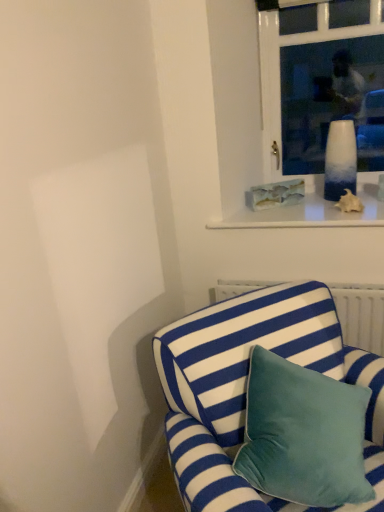
What is the approximate width of blue and white striped fabric couch at lower right?

It is 31.85 inches.

The image size is (384, 512). Find the location of `blue and white striped fabric couch at lower right`. blue and white striped fabric couch at lower right is located at coordinates (246, 386).

Is blue and white striped fabric couch at lower right directly adjacent to white glass vase at upper center?

blue and white striped fabric couch at lower right and white glass vase at upper center are not in contact.

Considering the sizes of objects blue and white striped fabric couch at lower right and white glass vase at upper center in the image provided, who is wider, blue and white striped fabric couch at lower right or white glass vase at upper center?

blue and white striped fabric couch at lower right.

Is blue and white striped fabric couch at lower right smaller than white glass vase at upper center?

No, blue and white striped fabric couch at lower right is not smaller than white glass vase at upper center.

From the picture: From a real-world perspective, is blue and white striped fabric couch at lower right over white glass vase at upper center?

No, from a real-world perspective, blue and white striped fabric couch at lower right is not on top of white glass vase at upper center.

Would you say translucent glass vase at upper right is a long distance from white glass vase at upper center?

No, translucent glass vase at upper right is not far away from white glass vase at upper center.

From the image's perspective, which object appears higher, translucent glass vase at upper right or white glass vase at upper center?

white glass vase at upper center appears higher in the image.

Between point (342, 183) and point (259, 0), which one is positioned behind?

The point (342, 183) is more distant.

Is translucent glass vase at upper right behind white glass vase at upper center?

Yes, translucent glass vase at upper right is behind white glass vase at upper center.

From the image's perspective, which is below, blue and white striped fabric couch at lower right or translucent glass vase at upper right?

blue and white striped fabric couch at lower right, from the image's perspective.

Is blue and white striped fabric couch at lower right behind translucent glass vase at upper right?

No, the depth of blue and white striped fabric couch at lower right is less than that of translucent glass vase at upper right.

From a real-world perspective, between blue and white striped fabric couch at lower right and translucent glass vase at upper right, who is vertically higher?

translucent glass vase at upper right.

Which of these two, blue and white striped fabric couch at lower right or translucent glass vase at upper right, is smaller?

Smaller between the two is translucent glass vase at upper right.

Between point (293, 9) and point (351, 142), which one is positioned behind?

The point (293, 9) is farther.

Is white glass vase at upper center oriented towards translucent glass vase at upper right?

Yes.

Between white glass vase at upper center and translucent glass vase at upper right, which one is positioned behind?

translucent glass vase at upper right is further from the camera.

Which of these two, translucent glass vase at upper right or blue and white striped fabric couch at lower right, stands taller?

Standing taller between the two is blue and white striped fabric couch at lower right.

Which object is wider, translucent glass vase at upper right or blue and white striped fabric couch at lower right?

blue and white striped fabric couch at lower right is wider.

Which is more to the right, translucent glass vase at upper right or blue and white striped fabric couch at lower right?

translucent glass vase at upper right.

Choose the correct answer: Is white glass vase at upper center inside blue and white striped fabric couch at lower right or outside it?

white glass vase at upper center is not enclosed by blue and white striped fabric couch at lower right.

In terms of width, does white glass vase at upper center look wider or thinner when compared to blue and white striped fabric couch at lower right?

In the image, white glass vase at upper center appears to be more narrow than blue and white striped fabric couch at lower right.

Considering the points (313, 155) and (215, 377), which point is behind, point (313, 155) or point (215, 377)?

Positioned behind is point (313, 155).

Could you measure the distance between white glass vase at upper center and blue and white striped fabric couch at lower right?

A distance of 1.28 meters exists between white glass vase at upper center and blue and white striped fabric couch at lower right.

Identify the location of window on the right of the blue and white striped fabric couch at lower right. (321, 82).

Image resolution: width=384 pixels, height=512 pixels. I want to click on window in front of the translucent glass vase at upper right, so pyautogui.click(x=321, y=82).

From the image, which object appears to be nearer to blue and white striped fabric couch at lower right, white glass vase at upper center or translucent glass vase at upper right?

translucent glass vase at upper right is closer to blue and white striped fabric couch at lower right.

Looking at the image, which one is located further to translucent glass vase at upper right, white glass vase at upper center or blue and white striped fabric couch at lower right?

blue and white striped fabric couch at lower right is further to translucent glass vase at upper right.

Estimate the real-world distances between objects in this image. Which object is closer to white glass vase at upper center, translucent glass vase at upper right or blue and white striped fabric couch at lower right?

Based on the image, translucent glass vase at upper right appears to be nearer to white glass vase at upper center.

From the image, which object appears to be nearer to translucent glass vase at upper right, blue and white striped fabric couch at lower right or white glass vase at upper center?

white glass vase at upper center lies closer to translucent glass vase at upper right than the other object.

Considering their positions, is blue and white striped fabric couch at lower right positioned further to white glass vase at upper center than translucent glass vase at upper right?

blue and white striped fabric couch at lower right is further to white glass vase at upper center.

Which object lies nearer to the anchor point blue and white striped fabric couch at lower right, translucent glass vase at upper right or white glass vase at upper center?

translucent glass vase at upper right is positioned closer to the anchor blue and white striped fabric couch at lower right.

Find the location of `window between blue and white striped fabric couch at lower right and translucent glass vase at upper right from front to back`. window between blue and white striped fabric couch at lower right and translucent glass vase at upper right from front to back is located at coordinates (321, 82).